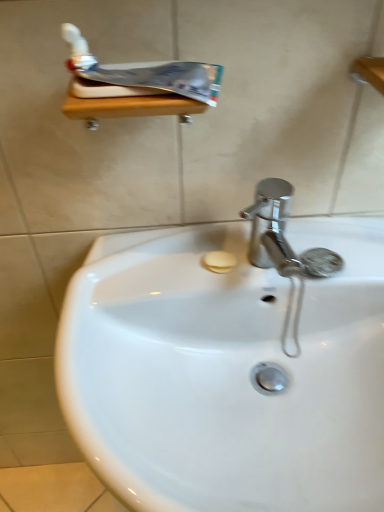
Question: Is white glossy sink at center not near white glossy toothpaste at upper left?

Choices:
 (A) yes
 (B) no

Answer: (B)

Question: Considering the relative sizes of white glossy sink at center and white glossy toothpaste at upper left in the image provided, is white glossy sink at center smaller than white glossy toothpaste at upper left?

Choices:
 (A) no
 (B) yes

Answer: (A)

Question: From a real-world perspective, does white glossy sink at center stand above white glossy toothpaste at upper left?

Choices:
 (A) no
 (B) yes

Answer: (A)

Question: Can you confirm if white glossy sink at center is positioned to the left of white glossy toothpaste at upper left?

Choices:
 (A) no
 (B) yes

Answer: (A)

Question: Considering the relative sizes of white glossy sink at center and white glossy toothpaste at upper left in the image provided, is white glossy sink at center shorter than white glossy toothpaste at upper left?

Choices:
 (A) no
 (B) yes

Answer: (A)

Question: Can you confirm if white glossy sink at center is bigger than white glossy toothpaste at upper left?

Choices:
 (A) no
 (B) yes

Answer: (B)

Question: Would you say white glossy toothpaste at upper left is outside white glossy sink at center?

Choices:
 (A) yes
 (B) no

Answer: (A)

Question: From the image's perspective, is white glossy toothpaste at upper left below white glossy sink at center?

Choices:
 (A) no
 (B) yes

Answer: (A)

Question: Is white glossy toothpaste at upper left directly adjacent to white glossy sink at center?

Choices:
 (A) no
 (B) yes

Answer: (A)

Question: From the image's perspective, would you say white glossy toothpaste at upper left is positioned over white glossy sink at center?

Choices:
 (A) yes
 (B) no

Answer: (A)

Question: Does white glossy toothpaste at upper left have a lesser height compared to white glossy sink at center?

Choices:
 (A) no
 (B) yes

Answer: (B)

Question: Is white glossy toothpaste at upper left wider than white glossy sink at center?

Choices:
 (A) yes
 (B) no

Answer: (B)

Question: Which is correct: white glossy toothpaste at upper left is inside white glossy sink at center, or outside of it?

Choices:
 (A) inside
 (B) outside

Answer: (B)